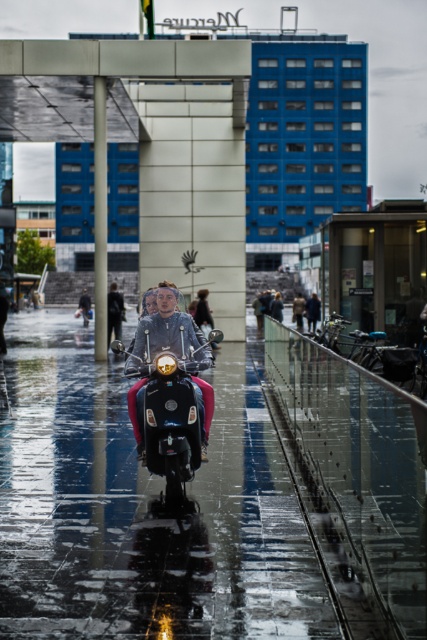
You are a photographer standing in the rain, trying to capture the shiny black scooter at center and the matte gray jacket at center. Which object is closer to the camera?

The shiny black scooter at center is positioned under the matte gray jacket at center, so the jacket is closer to the camera.

You are a delivery person who needs to know if the shiny black scooter at center can fit through a doorway that is exactly the same height as the matte gray jacket at center. Based on the scene, can the scooter pass through?

The shiny black scooter at center has a greater height compared to the matte gray jacket at center. Since the doorway is the same height as the jacket, the scooter cannot pass through due to its taller stature.